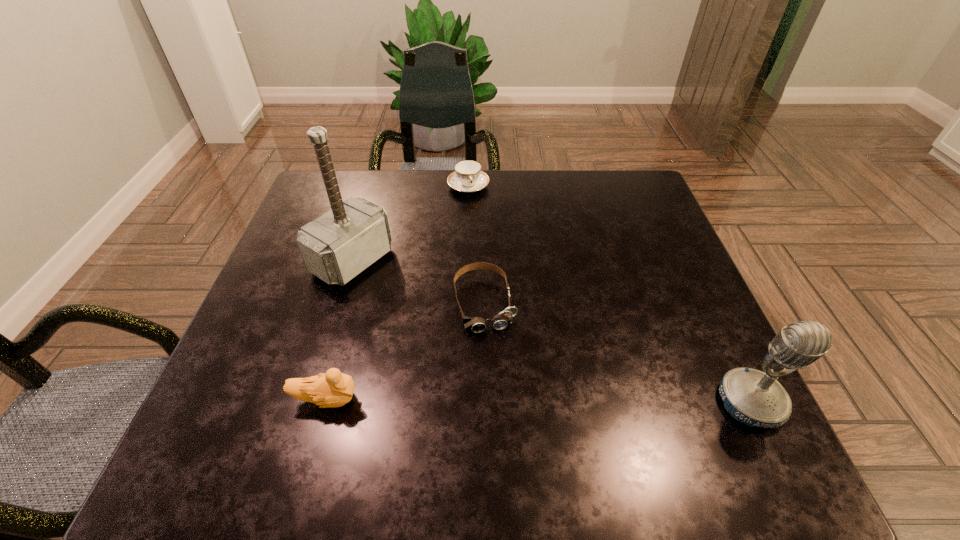
This screenshot has height=540, width=960. In order to click on object that can be found as the second closest to the farthest object in this screenshot , I will do `click(505, 318)`.